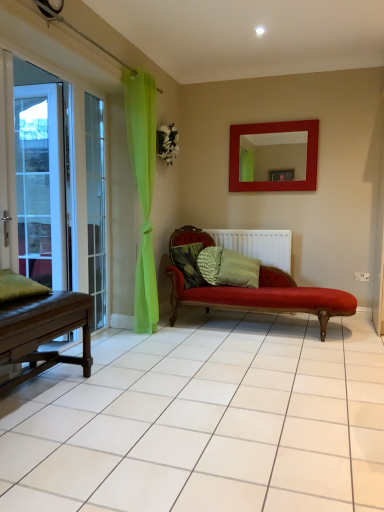
Question: Is textured green pillow at center, which ranks as the second pillow in left-to-right order, spatially inside green fabric pillow at left, which is the 4th pillow from right to left, or outside of it?

Choices:
 (A) outside
 (B) inside

Answer: (A)

Question: Considering the positions of point (183, 268) and point (21, 294), is point (183, 268) closer or farther from the camera than point (21, 294)?

Choices:
 (A) closer
 (B) farther

Answer: (B)

Question: Which object is the closest to the clear glass door at left?

Choices:
 (A) textured green pillow at center, which is the 1th pillow from back to front
 (B) white matte radiator at center
 (C) white glass screen door at left
 (D) green textured pillow at center, the first pillow when ordered from right to left
 (E) matte red mirror at upper center

Answer: (C)

Question: Based on their relative distances, which object is nearer to the textured green pillow at center, the 2th pillow positioned from the front?

Choices:
 (A) textured green pillow at center, which is the fourth pillow from front to back
 (B) matte red mirror at upper center
 (C) green textured pillow at center, the second pillow from the back
 (D) white glass screen door at left
 (E) clear glass door at left

Answer: (A)